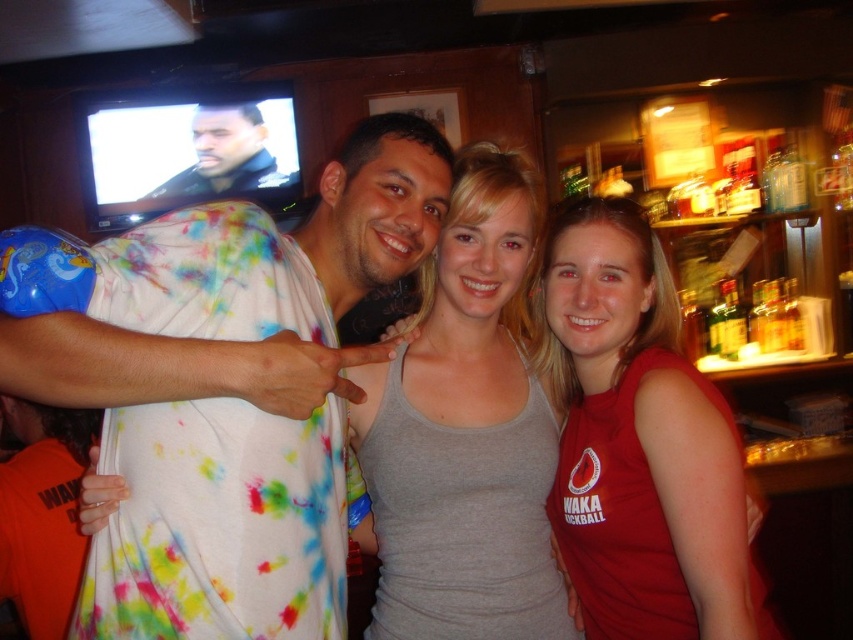
Is tie-dye fabric shirt at center further to the viewer compared to matte red tank top at center?

That is False.

Measure the distance between tie-dye fabric shirt at center and matte red tank top at center.

The distance of tie-dye fabric shirt at center from matte red tank top at center is 18.37 inches.

Who is more forward, (219,358) or (682,566)?

Point (219,358) is more forward.

The image size is (853, 640). Identify the location of tie-dye fabric shirt at center. (222, 387).

Does tie-dye fabric shirt at center have a larger size compared to gray matte tank top at center?

Correct, tie-dye fabric shirt at center is larger in size than gray matte tank top at center.

Does tie-dye fabric shirt at center come behind gray matte tank top at center?

No, it is in front of gray matte tank top at center.

Between point (198, 545) and point (479, 406), which one is positioned behind?

The point (479, 406) is behind.

This screenshot has width=853, height=640. I want to click on tie-dye fabric shirt at center, so click(x=222, y=387).

Which is above, matte red tank top at center or dark blue leather jacket at upper left?

dark blue leather jacket at upper left is above.

Does point (634, 436) lie in front of point (242, 145)?

Yes, it is in front of point (242, 145).

Where is `matte red tank top at center`? The width and height of the screenshot is (853, 640). matte red tank top at center is located at coordinates (637, 442).